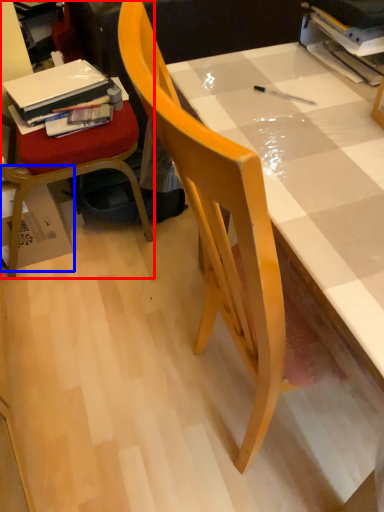
Question: Among these objects, which one is nearest to the camera, chair (highlighted by a red box) or cardboard box (highlighted by a blue box)?

Choices:
 (A) chair
 (B) cardboard box

Answer: (A)